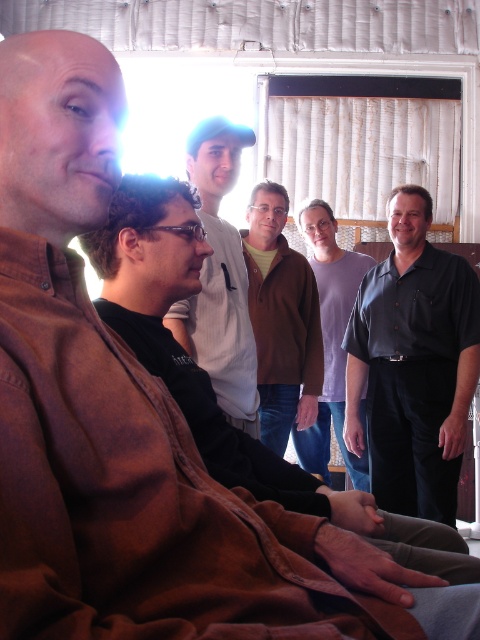
Can you confirm if black shirt at right is positioned to the right of brown sweater at center?

Yes, black shirt at right is to the right of brown sweater at center.

Who is positioned more to the right, black shirt at right or brown sweater at center?

Positioned to the right is black shirt at right.

This screenshot has width=480, height=640. I want to click on black shirt at right, so coord(414,364).

Find the location of a particular element. black shirt at right is located at coordinates (414, 364).

Between point (217, 209) and point (264, 275), which one is positioned in front?

Point (217, 209) is in front.

Does white cotton shirt at center have a larger size compared to brown sweater at center?

Actually, white cotton shirt at center might be smaller than brown sweater at center.

Which is behind, point (235, 424) or point (271, 262)?

The point (271, 262) is more distant.

Find the location of a particular element. Image resolution: width=480 pixels, height=640 pixels. white cotton shirt at center is located at coordinates (219, 278).

Between brown sweater at center and purple cotton shirt at center, which one appears on the left side from the viewer's perspective?

From the viewer's perspective, brown sweater at center appears more on the left side.

Is point (260, 228) in front of point (351, 456)?

Yes, it is.

You are a GUI agent. You are given a task and a screenshot of the screen. Output one action in this format:
    pyautogui.click(x=<x>, y=<y>)
    Task: Click on the brown sweater at center
    
    Given the screenshot: What is the action you would take?
    pyautogui.click(x=282, y=320)